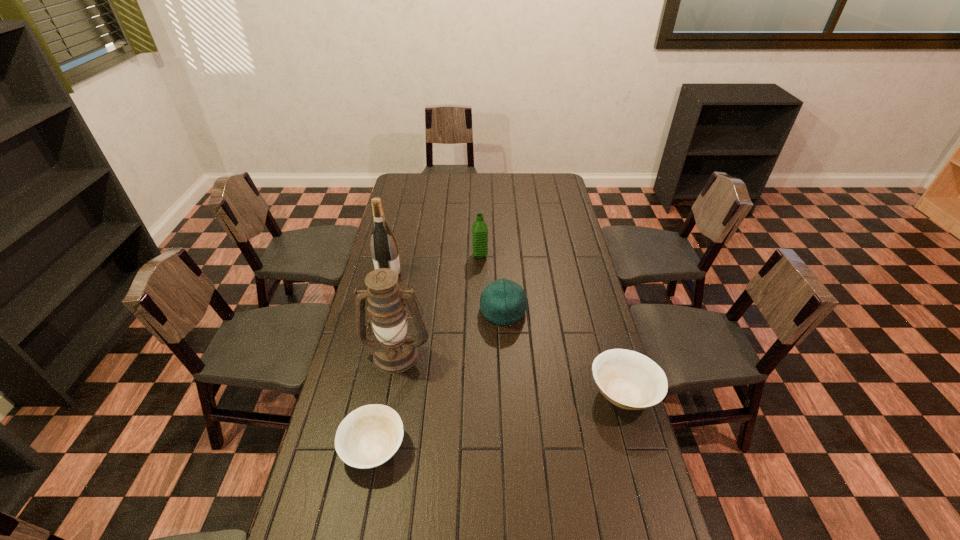
Locate an element on the screen. Image resolution: width=960 pixels, height=540 pixels. free space that is in between the oil lamp and the farthest object is located at coordinates (438, 304).

Locate an element on the screen. vacant space that's between the third tallest object and the wine bottle is located at coordinates (435, 266).

You are a GUI agent. You are given a task and a screenshot of the screen. Output one action in this format:
    pyautogui.click(x=<x>, y=<y>)
    Task: Click on the third closest object to the wine bottle
    The width and height of the screenshot is (960, 540).
    Given the screenshot: What is the action you would take?
    pyautogui.click(x=503, y=302)

Locate which object ranks fifth in proximity to the third tallest object. Please provide its 2D coordinates. Your answer should be formatted as a tuple, i.e. [(x, y)], where the tuple contains the x and y coordinates of a point satisfying the conditions above.

[(369, 436)]

Where is `free space that satisfies the following two spatial constraints: 1. on the label of the beanie; 2. on the right side of the second farthest object`? This screenshot has height=540, width=960. free space that satisfies the following two spatial constraints: 1. on the label of the beanie; 2. on the right side of the second farthest object is located at coordinates coord(380,311).

At what (x,y) coordinates should I click in order to perform the action: click on free space in the image that satisfies the following two spatial constraints: 1. on the back side of the water bottle; 2. on the left side of the left bowl. Please return your answer as a coordinate pair (x, y). This screenshot has width=960, height=540. Looking at the image, I should click on (411, 255).

Where is `free space that satisfies the following two spatial constraints: 1. on the front side of the fourth nearest object; 2. on the right side of the fifth tallest object`? The image size is (960, 540). free space that satisfies the following two spatial constraints: 1. on the front side of the fourth nearest object; 2. on the right side of the fifth tallest object is located at coordinates (508, 393).

You are a GUI agent. You are given a task and a screenshot of the screen. Output one action in this format:
    pyautogui.click(x=<x>, y=<y>)
    Task: Click on the free spot that satisfies the following two spatial constraints: 1. on the label of the fifth nearest object; 2. on the left side of the second shortest object
    Image resolution: width=960 pixels, height=540 pixels.
    Given the screenshot: What is the action you would take?
    pyautogui.click(x=361, y=393)

Locate an element on the screen. Image resolution: width=960 pixels, height=540 pixels. vacant space that satisfies the following two spatial constraints: 1. on the label of the oil lamp; 2. on the left side of the wine bottle is located at coordinates (371, 353).

At what (x,y) coordinates should I click in order to perform the action: click on free spot that satisfies the following two spatial constraints: 1. on the label of the fifth nearest object; 2. on the back side of the beanie. Please return your answer as a coordinate pair (x, y). The height and width of the screenshot is (540, 960). Looking at the image, I should click on (380, 311).